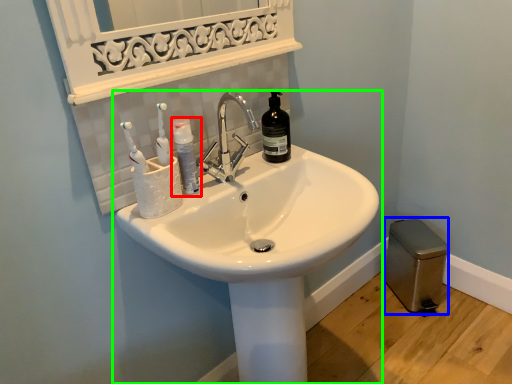
Question: Which object is positioned closest to mouthwash (highlighted by a red box)? Select from gray (highlighted by a blue box) and sink (highlighted by a green box).

Choices:
 (A) gray
 (B) sink

Answer: (B)